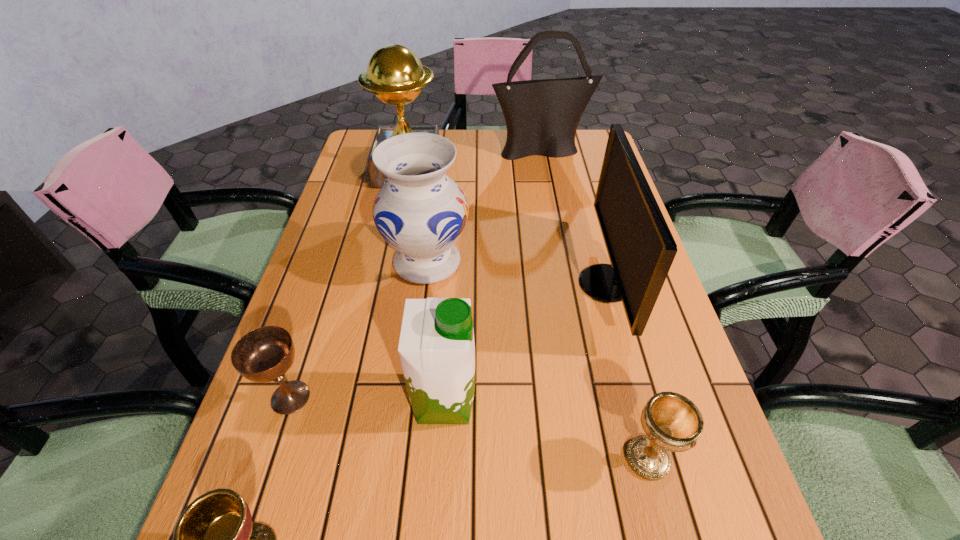
Image resolution: width=960 pixels, height=540 pixels. I want to click on award, so click(x=395, y=74).

Locate an element on the screen. shoulder bag is located at coordinates (542, 116).

The image size is (960, 540). Find the location of `vase`. vase is located at coordinates (421, 212).

Locate an element on the screen. The height and width of the screenshot is (540, 960). computer monitor is located at coordinates (641, 249).

At what (x,y) coordinates should I click in order to perform the action: click on soya milk. Please return your answer as a coordinate pair (x, y). This screenshot has height=540, width=960. Looking at the image, I should click on click(436, 347).

Locate an element on the screen. the farthest chalice is located at coordinates (265, 354).

Locate an element on the screen. This screenshot has width=960, height=540. the second nearest object is located at coordinates (672, 422).

Where is `the rightmost chalice`? The height and width of the screenshot is (540, 960). the rightmost chalice is located at coordinates (672, 422).

This screenshot has height=540, width=960. I want to click on vacant space located on the front-facing side of the award, so click(384, 293).

Identify the location of free space located on the left of the shoulder bag. The height and width of the screenshot is (540, 960). (471, 150).